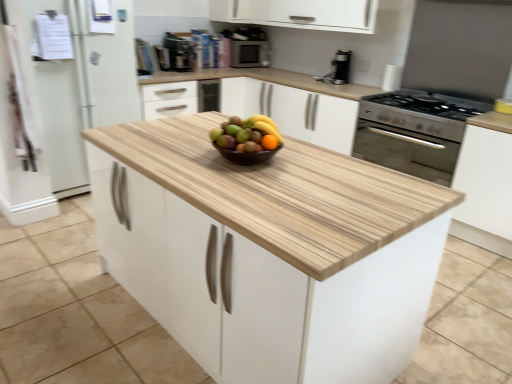
Question: Which direction should I rotate to look at natural wood cabinet at center, which ranks as the first cabinetry in bottom-to-top order?

Choices:
 (A) left
 (B) right

Answer: (B)

Question: Is the depth of black plastic coffee machine at upper center greater than that of white wood cabinet at upper center, the 1th cabinetry from the top?

Choices:
 (A) no
 (B) yes

Answer: (A)

Question: Can you confirm if black plastic coffee machine at upper center is thinner than white wood cabinet at upper center, positioned as the first cabinetry in back-to-front order?

Choices:
 (A) yes
 (B) no

Answer: (A)

Question: Is black plastic coffee machine at upper center positioned with its back to white wood cabinet at upper center, the 3th cabinetry in the front-to-back sequence?

Choices:
 (A) no
 (B) yes

Answer: (A)

Question: Is white wood cabinet at upper center, positioned as the first cabinetry in back-to-front order, inside black plastic coffee machine at upper center?

Choices:
 (A) yes
 (B) no

Answer: (B)

Question: From the image's perspective, is black plastic coffee machine at upper center below white wood cabinet at upper center, the 3th cabinetry in the front-to-back sequence?

Choices:
 (A) yes
 (B) no

Answer: (A)

Question: Is black plastic coffee machine at upper center positioned before white wood cabinet at upper center, the 3th cabinetry in the front-to-back sequence?

Choices:
 (A) no
 (B) yes

Answer: (B)

Question: Does white matte cabinet at right, the second cabinetry when ordered from back to front, come behind satin black coffee maker at upper right?

Choices:
 (A) no
 (B) yes

Answer: (A)

Question: From a real-world perspective, is white matte cabinet at right, placed as the 2th cabinetry when sorted from front to back, located beneath satin black coffee maker at upper right?

Choices:
 (A) yes
 (B) no

Answer: (A)

Question: Is white matte cabinet at right, the second cabinetry when ordered from back to front, to the right of satin black coffee maker at upper right from the viewer's perspective?

Choices:
 (A) no
 (B) yes

Answer: (B)

Question: Would you consider white matte cabinet at right, placed as the 2th cabinetry when sorted from front to back, to be distant from satin black coffee maker at upper right?

Choices:
 (A) no
 (B) yes

Answer: (B)

Question: Is white matte cabinet at right, placed as the 2th cabinetry when sorted from front to back, bigger than satin black coffee maker at upper right?

Choices:
 (A) yes
 (B) no

Answer: (A)

Question: From the image's perspective, is white matte cabinet at right, the second cabinetry from the top, above satin black coffee maker at upper right?

Choices:
 (A) yes
 (B) no

Answer: (B)

Question: Is black plastic coffee machine at upper center further to the viewer compared to natural wood cabinet at center, which ranks as the first cabinetry in bottom-to-top order?

Choices:
 (A) no
 (B) yes

Answer: (B)